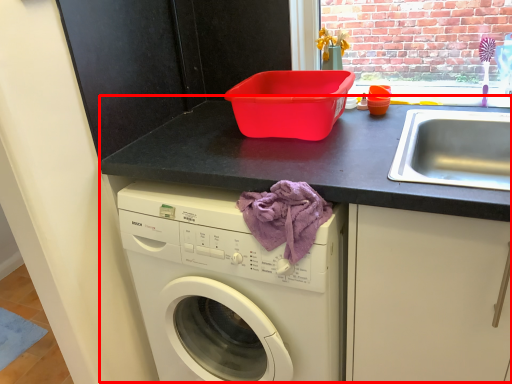
Question: From the image's perspective, where is counter (annotated by the red box) located relative to blanket?

Choices:
 (A) below
 (B) above

Answer: (A)